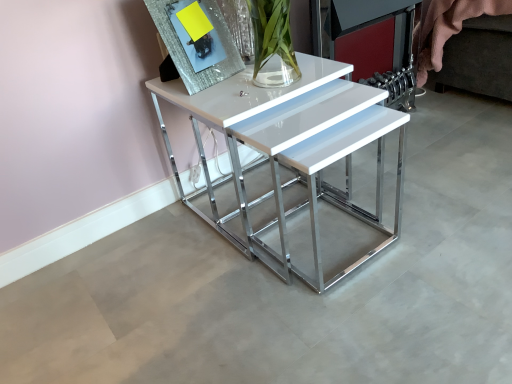
The height and width of the screenshot is (384, 512). I want to click on free spot below white glossy table at center (from a real-world perspective), so (x=281, y=206).